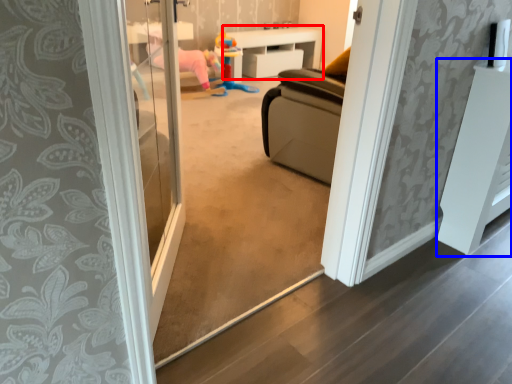
Question: Which point is further to the camera, furniture (highlighted by a red box) or furniture (highlighted by a blue box)?

Choices:
 (A) furniture
 (B) furniture

Answer: (A)